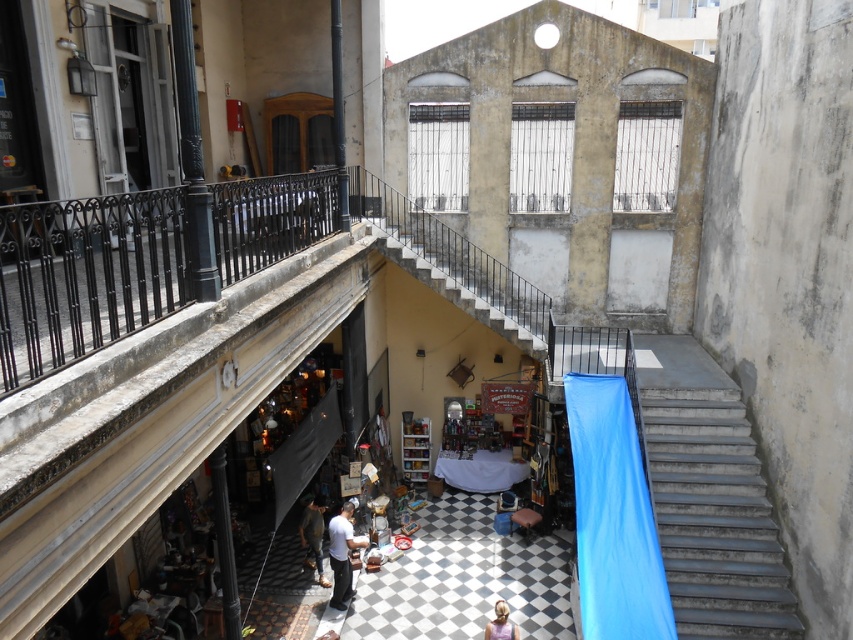
You are a customer in the market and want to reach the balcony to get a better view. You see the metallic gray stairs at right and the light brown hair at lower center. Which object is closer to you and should you move towards first?

The light brown hair at lower center is closer to you than the metallic gray stairs at right. You should move towards the light brown hair at lower center first.

You are a customer at the outdoor market and want to reach the balcony above. You see the metallic gray stairs at right and the light brown hair at lower center. Which object is positioned to the right side of the other?

The metallic gray stairs at right are to the right of the light brown hair at lower center.

You are a customer at the market and want to reach the balcony above to get a better view. The metallic gray stairs at right and the light brown leather pants at center are in your path. Which object should you move around to avoid obstruction?

You should move around the metallic gray stairs at right because it is larger in size than the light brown leather pants at center and would block your path more significantly.